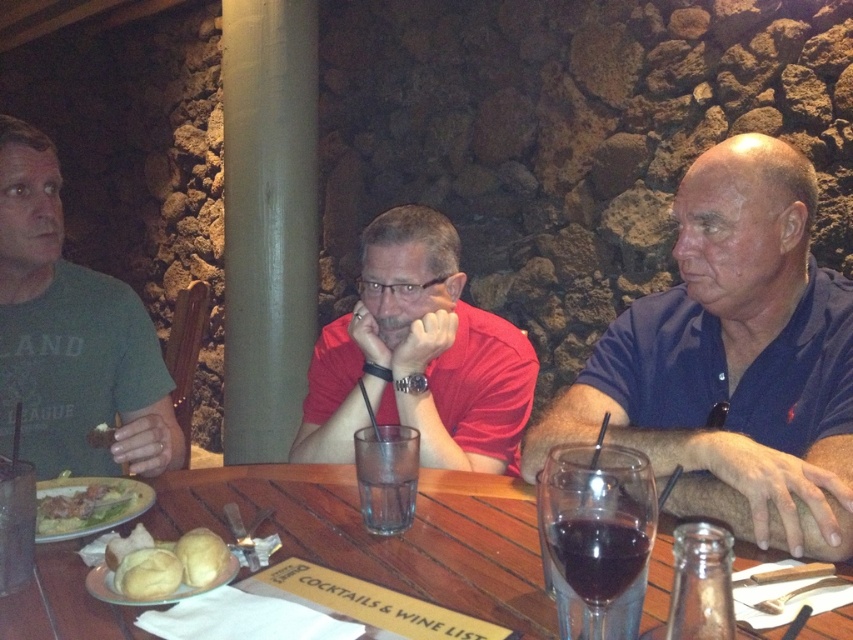
Question: Does transparent glass wine at center have a greater width compared to dark glass wine at center?

Choices:
 (A) yes
 (B) no

Answer: (A)

Question: Which point is farther to the camera?

Choices:
 (A) transparent glass wine at center
 (B) dark blue polo shirt at right
 (C) golden brown bread at lower left

Answer: (B)

Question: Where is transparent glass wine at center located in relation to golden brown bread at center in the image?

Choices:
 (A) above
 (B) below

Answer: (A)

Question: Can you confirm if green matte shirt at left is bigger than transparent glass wine at center?

Choices:
 (A) yes
 (B) no

Answer: (A)

Question: Which of the following is the closest to the observer?

Choices:
 (A) (74, 492)
 (B) (392, 528)

Answer: (B)

Question: Among these objects, which one is farthest from the camera?

Choices:
 (A) matte red shirt at center
 (B) clear glass at table center
 (C) dark glass wine at center

Answer: (A)